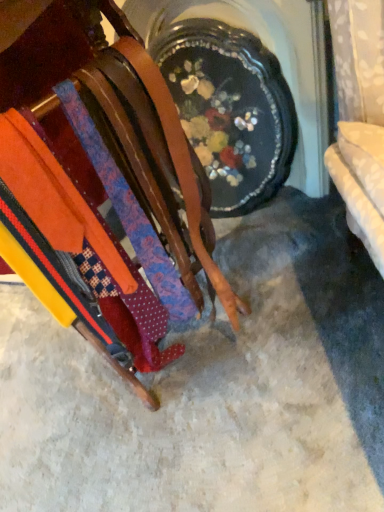
Question: From a real-world perspective, is wooden rack of ties at center physically above orange fabric at left?

Choices:
 (A) yes
 (B) no

Answer: (A)

Question: Is there a large distance between wooden rack of ties at center and orange fabric at left?

Choices:
 (A) yes
 (B) no

Answer: (B)

Question: From a real-world perspective, is wooden rack of ties at center physically below orange fabric at left?

Choices:
 (A) yes
 (B) no

Answer: (B)

Question: Can you see wooden rack of ties at center touching orange fabric at left?

Choices:
 (A) no
 (B) yes

Answer: (A)

Question: Can you confirm if wooden rack of ties at center is wider than orange fabric at left?

Choices:
 (A) no
 (B) yes

Answer: (A)

Question: Does wooden rack of ties at center have a lesser height compared to orange fabric at left?

Choices:
 (A) no
 (B) yes

Answer: (A)

Question: Is orange fabric at left next to wooden rack of ties at center?

Choices:
 (A) no
 (B) yes

Answer: (A)

Question: Is orange fabric at left shorter than wooden rack of ties at center?

Choices:
 (A) no
 (B) yes

Answer: (B)

Question: Considering the relative sizes of orange fabric at left and wooden rack of ties at center in the image provided, is orange fabric at left wider than wooden rack of ties at center?

Choices:
 (A) yes
 (B) no

Answer: (A)

Question: Is orange fabric at left positioned before wooden rack of ties at center?

Choices:
 (A) no
 (B) yes

Answer: (A)

Question: Is orange fabric at left facing towards wooden rack of ties at center?

Choices:
 (A) yes
 (B) no

Answer: (B)

Question: From the image's perspective, does orange fabric at left appear higher than wooden rack of ties at center?

Choices:
 (A) no
 (B) yes

Answer: (A)

Question: From the image's perspective, is wooden rack of ties at center above or below orange fabric at left?

Choices:
 (A) above
 (B) below

Answer: (A)